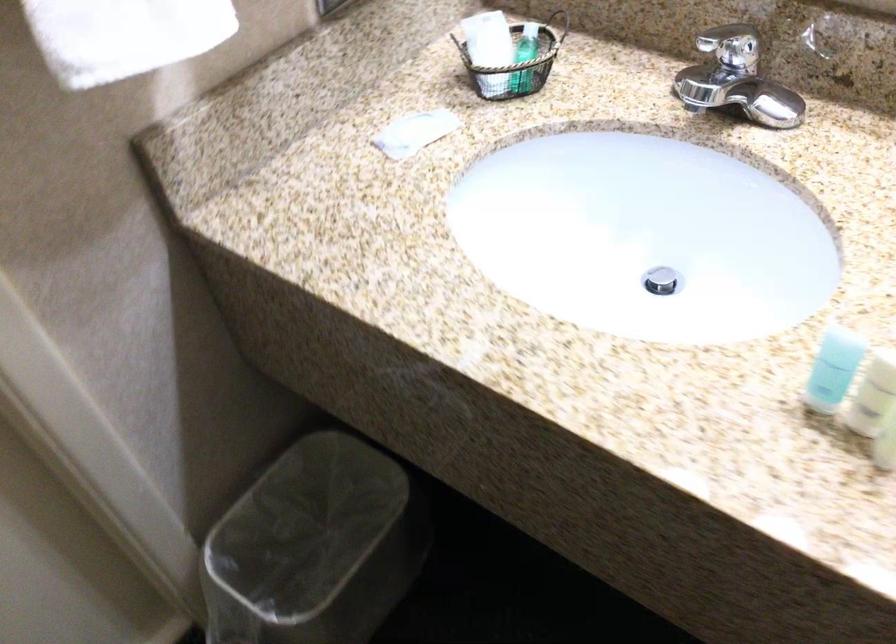
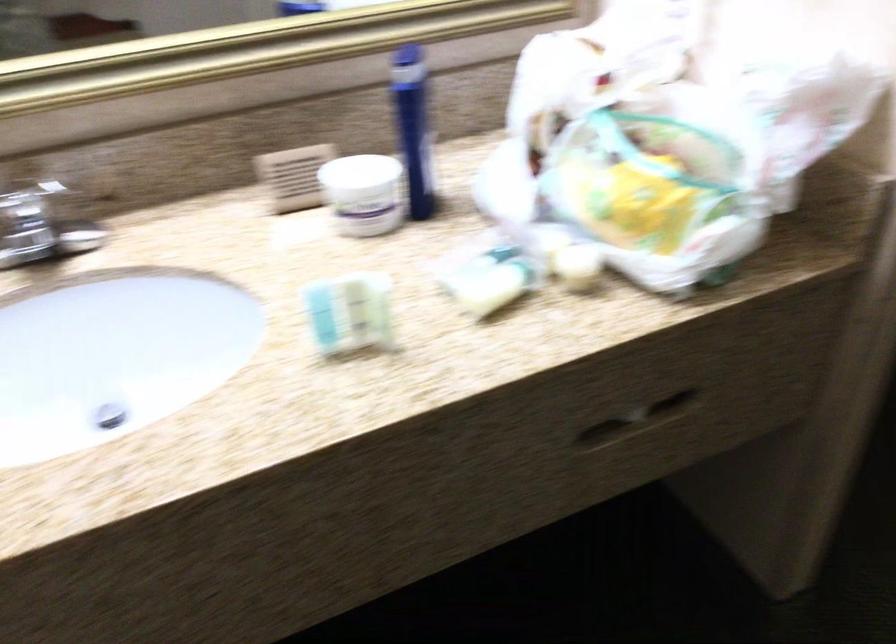
Question: The first image is from the beginning of the video and the second image is from the end. How did the camera likely rotate when shooting the video?

Choices:
 (A) Left
 (B) Right
 (C) Up
 (D) Down

Answer: (B)